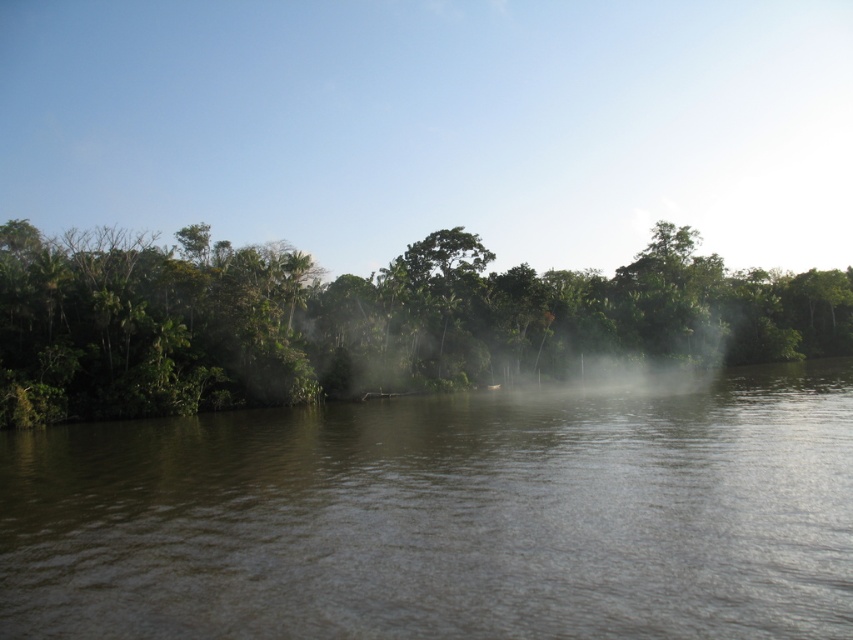
From the picture: You are standing at the riverside and see the brown murky water at center and the green leafy trees at center. Which object is closer to the ground?

The brown murky water at center is closer to the ground because it is located below the green leafy trees at center.

You are a hiker who wants to cross the river. You see the brown murky water at center and the green leafy trees at center. How far apart are these two landmarks?

The brown murky water at center and the green leafy trees at center are 37.45 meters apart.